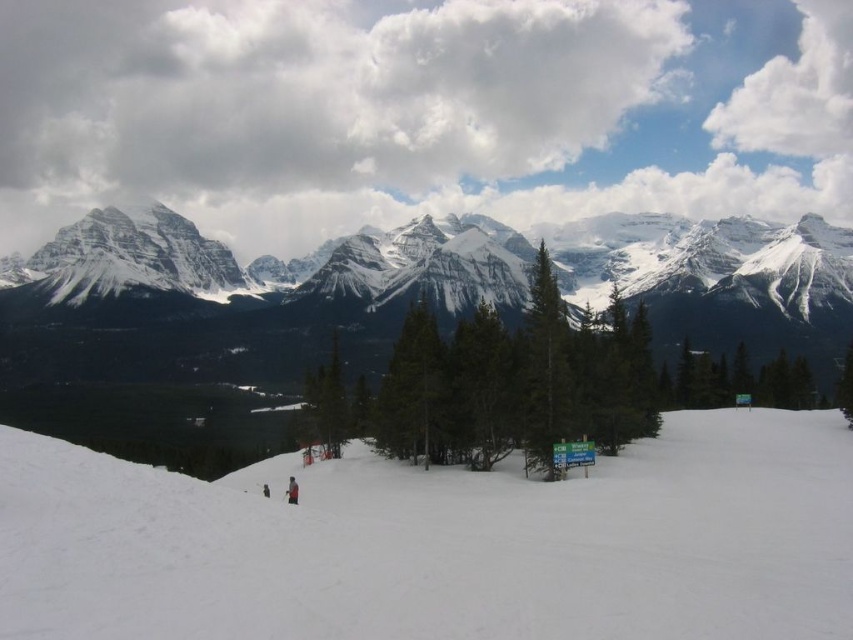
Is white snow at center above green matte tree at center?

No.

Is white snow at center further to the viewer compared to green matte tree at center?

No, white snow at center is closer to the viewer.

What do you see at coordinates (440, 541) in the screenshot?
I see `white snow at center` at bounding box center [440, 541].

Where is `white snow at center`? The height and width of the screenshot is (640, 853). white snow at center is located at coordinates (440, 541).

Is snowy granite mountain range at upper center positioned at the back of green matte tree at center?

Yes.

Is point (128, 230) positioned in front of point (556, 408)?

No, it is behind (556, 408).

Identify the location of snowy granite mountain range at upper center. The image size is (853, 640). (274, 264).

Can you confirm if white snow at center is bigger than green textured pine at center?

No, white snow at center is not bigger than green textured pine at center.

Which is behind, point (512, 608) or point (764, 392)?

Point (764, 392)

Where is `white snow at center`? white snow at center is located at coordinates (440, 541).